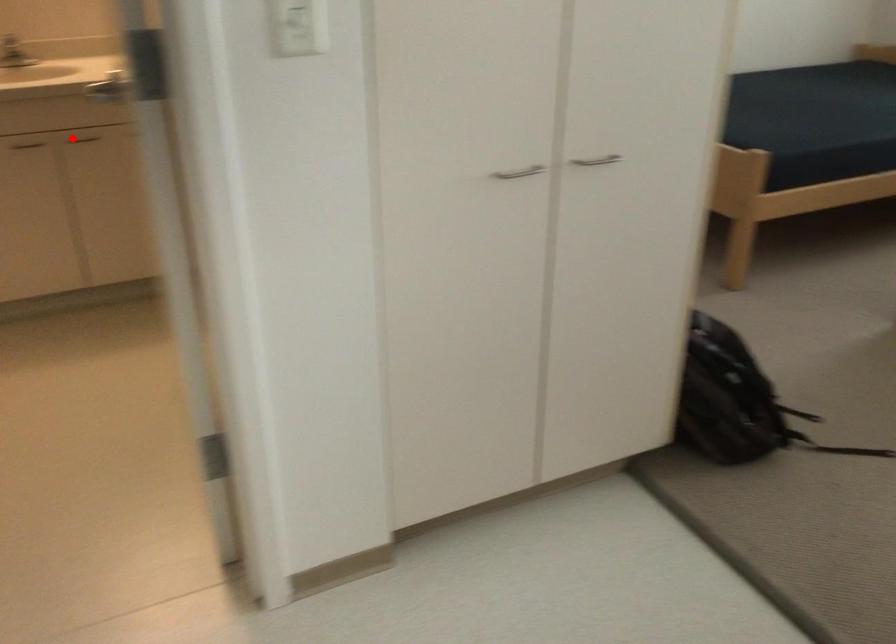
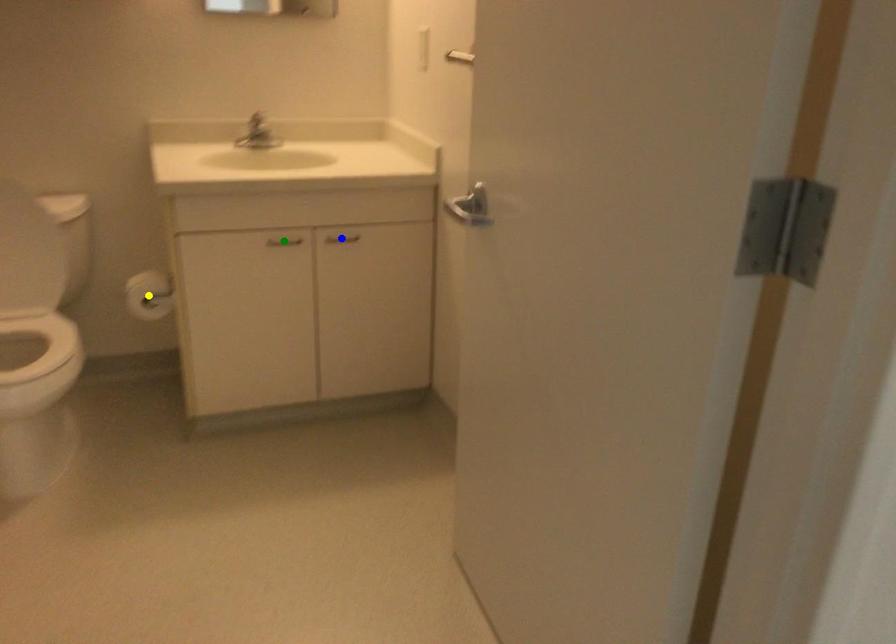
Question: I am providing you with two images of the same scene from different viewpoints. A red point is marked on the first image. You are given multiple points on the second image. Which point in image 2 is actually the same real-world point as the red point in image 1?

Choices:
 (A) green point
 (B) blue point
 (C) yellow point

Answer: (B)